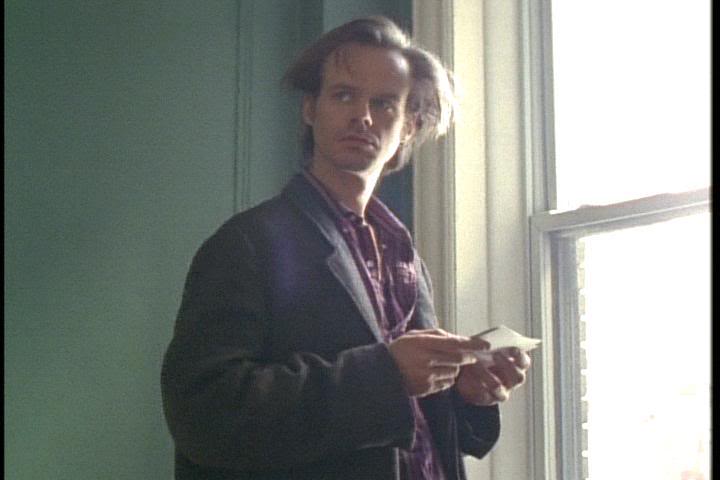
You are a GUI agent. You are given a task and a screenshot of the screen. Output one action in this format:
    pyautogui.click(x=<x>, y=<y>)
    Task: Click on the glass part of window
    The height and width of the screenshot is (480, 720).
    Given the screenshot: What is the action you would take?
    pyautogui.click(x=626, y=161), pyautogui.click(x=644, y=269)